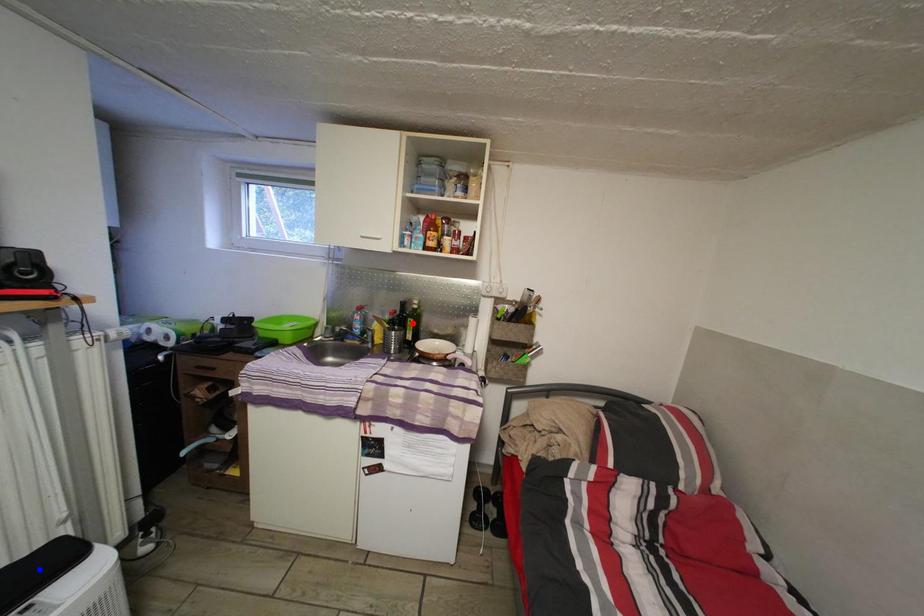
Question: Which of the two points in the image is closer to the camera?

Choices:
 (A) Blue point is closer.
 (B) Red point is closer.

Answer: (A)